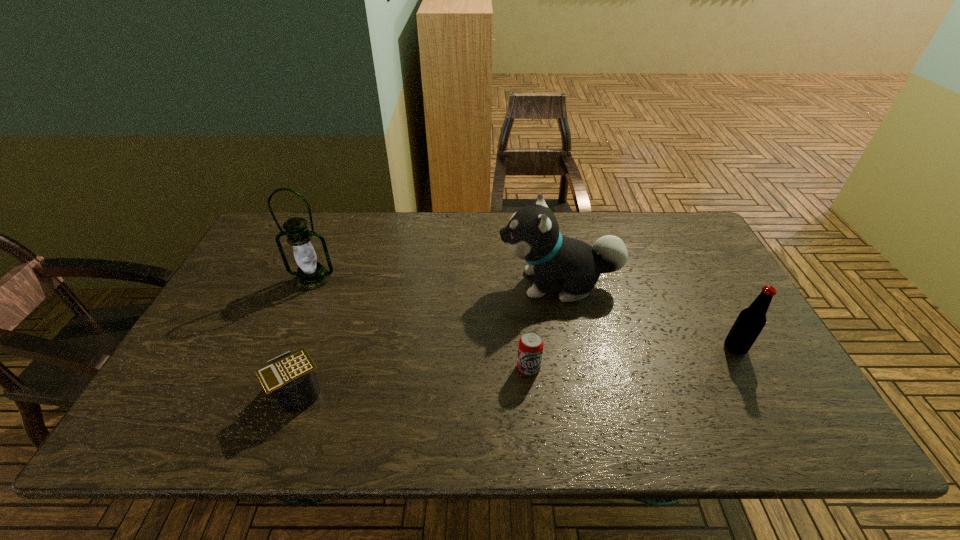
At what (x,y) coordinates should I click in order to perform the action: click on vacant space at the near left corner of the desktop. Please return your answer as a coordinate pair (x, y). This screenshot has width=960, height=540. Looking at the image, I should click on (206, 421).

Locate an element on the screen. This screenshot has height=540, width=960. empty space that is in between the puppy and the rightmost object is located at coordinates (647, 316).

Locate an element on the screen. free point between the calculator and the puppy is located at coordinates (429, 339).

The height and width of the screenshot is (540, 960). I want to click on vacant area that lies between the rightmost object and the lantern, so click(524, 313).

Where is `unoccupied area between the calculator and the puppy`? The image size is (960, 540). unoccupied area between the calculator and the puppy is located at coordinates (429, 339).

Locate an element on the screen. The height and width of the screenshot is (540, 960). empty space between the soda can and the calculator is located at coordinates (414, 380).

Locate an element on the screen. vacant space that is in between the puppy and the soda can is located at coordinates (543, 326).

I want to click on vacant space that is in between the lantern and the calculator, so click(306, 336).

Identify the location of free space between the puppy and the beer bottle. (647, 316).

The height and width of the screenshot is (540, 960). In order to click on blank region between the lantern and the calculator in this screenshot , I will do `click(306, 336)`.